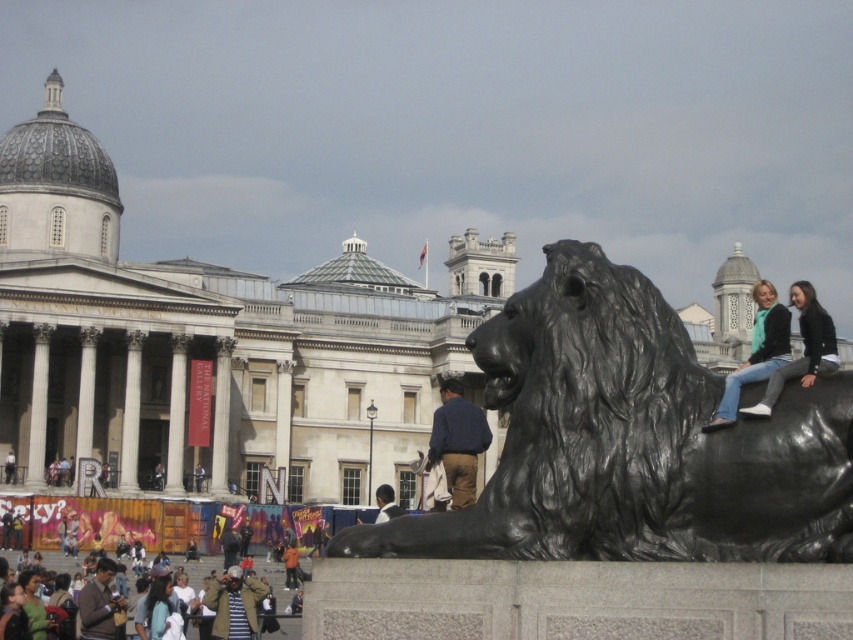
Question: In this image, where is blue cotton shirt at center located relative to striped sweater at lower left?

Choices:
 (A) below
 (B) above

Answer: (B)

Question: Is khaki jacket at lower center above light brown hair at center?

Choices:
 (A) yes
 (B) no

Answer: (B)

Question: Which object appears closest to the camera in this image?

Choices:
 (A) dark blue jeans at lower center
 (B) light brown hair at center

Answer: (B)

Question: Which is nearer to the orange shirt at center?

Choices:
 (A) black polished stone lion at center
 (B) dark blue jeans at lower center
 (C) jeans at right

Answer: (B)

Question: Which of these objects is positioned farthest from the jeans at center?

Choices:
 (A) khaki jacket at lower center
 (B) brown sweater at lower left
 (C) dark blue jeans at lower center

Answer: (C)

Question: Does jeans at right have a larger size compared to light brown hair at center?

Choices:
 (A) no
 (B) yes

Answer: (B)